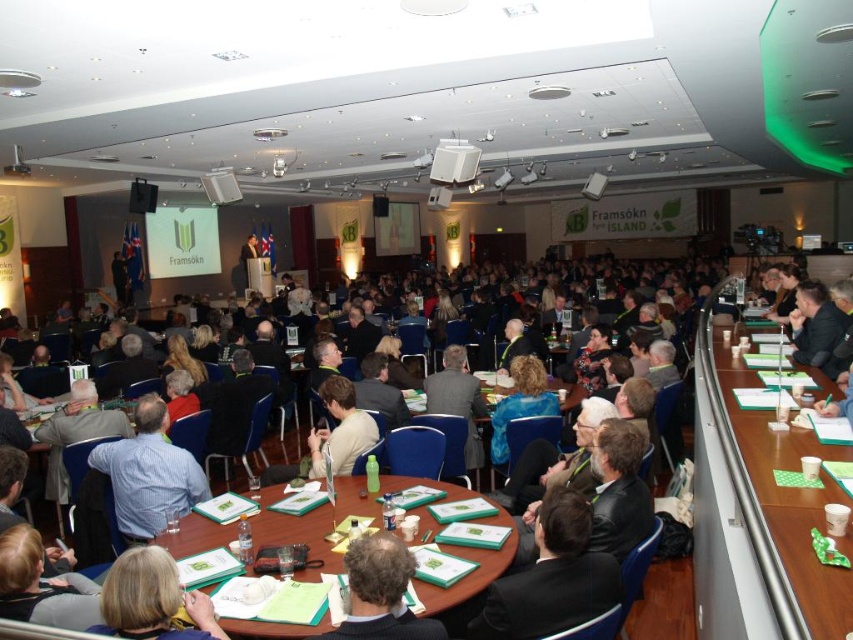
Question: Can you confirm if green paper at center is thinner than smooth paper folder at center?

Choices:
 (A) no
 (B) yes

Answer: (A)

Question: Which object is positioned closest to the green plastic table at right?

Choices:
 (A) smooth paper folder at center
 (B) green paper at center

Answer: (B)

Question: Is green paper at center bigger than smooth paper folder at center?

Choices:
 (A) no
 (B) yes

Answer: (B)

Question: Is green plastic table at right bigger than green paper at center?

Choices:
 (A) yes
 (B) no

Answer: (A)

Question: Among these points, which one is farthest from the camera?

Choices:
 (A) (132, 576)
 (B) (712, 476)

Answer: (B)

Question: Which point appears closest to the camera in this image?

Choices:
 (A) (181, 628)
 (B) (209, 540)

Answer: (A)